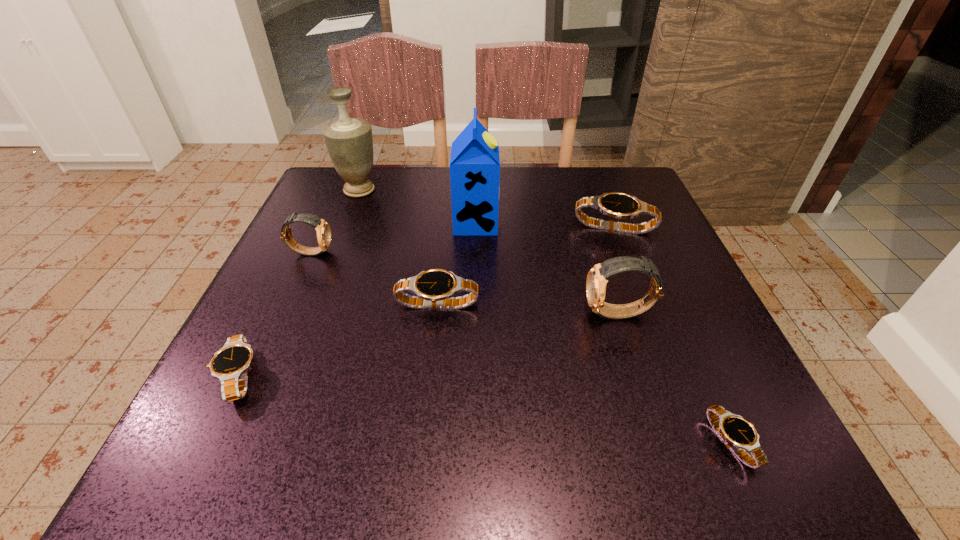
The height and width of the screenshot is (540, 960). Identify the location of vacant space positioned 0.150m on the left of the farthest watch. (505, 228).

The height and width of the screenshot is (540, 960). What are the coordinates of `vacant area situated 0.210m on the front of the third nearest black watch` in the screenshot? It's located at (424, 434).

This screenshot has height=540, width=960. What are the coordinates of `vacant area situated 0.350m on the back of the second nearest black watch` in the screenshot? It's located at (314, 223).

Image resolution: width=960 pixels, height=540 pixels. In order to click on vacant space positioned 0.160m on the back of the nearest black watch in this screenshot , I will do `click(681, 329)`.

Identify the location of urn that is at the far edge. (349, 141).

Find the location of `carton present at the far edge`. carton present at the far edge is located at coordinates (474, 163).

What are the coordinates of `watch situated at the far edge` in the screenshot? It's located at (618, 205).

You are a GUI agent. You are given a task and a screenshot of the screen. Output one action in this format:
    pyautogui.click(x=<x>, y=<y>)
    Task: Click on the object at the near edge
    
    Given the screenshot: What is the action you would take?
    pyautogui.click(x=739, y=434)

Where is `urn that is at the left edge`? The width and height of the screenshot is (960, 540). urn that is at the left edge is located at coordinates (349, 141).

Where is `object at the far left corner`? object at the far left corner is located at coordinates (349, 141).